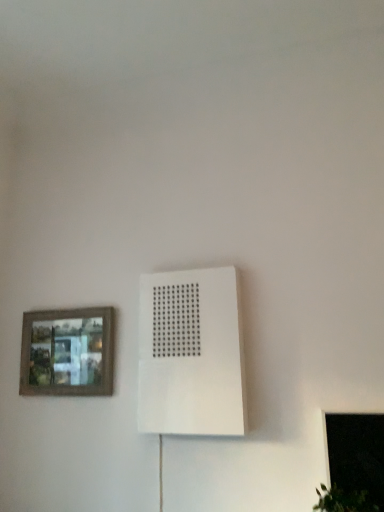
At what (x,y) coordinates should I click in order to perform the action: click on white matte air conditioning at center. Please return your answer as a coordinate pair (x, y). This screenshot has width=384, height=512. Looking at the image, I should click on (191, 354).

At what (x,y) coordinates should I click in order to perform the action: click on transparent glass window at lower right. Please return your answer as a coordinate pair (x, y). This screenshot has width=384, height=512. Looking at the image, I should click on (354, 464).

Where is `wooden framed picture at left`? The width and height of the screenshot is (384, 512). wooden framed picture at left is located at coordinates (67, 352).

In the scene shown: Is wooden framed picture at left far from transparent glass window at lower right?

Yes, wooden framed picture at left and transparent glass window at lower right are located far from each other.

Considering the sizes of wooden framed picture at left and transparent glass window at lower right in the image, is wooden framed picture at left bigger or smaller than transparent glass window at lower right?

Clearly, wooden framed picture at left is larger in size than transparent glass window at lower right.

From a real-world perspective, which is physically above, wooden framed picture at left or transparent glass window at lower right?

wooden framed picture at left is physically above.

Is transparent glass window at lower right thinner than white matte air conditioning at center?

Yes, transparent glass window at lower right is thinner than white matte air conditioning at center.

Which point is more distant from viewer, (356, 507) or (185, 343)?

Point (185, 343)

Which is more to the left, transparent glass window at lower right or white matte air conditioning at center?

From the viewer's perspective, white matte air conditioning at center appears more on the left side.

From the image's perspective, relative to white matte air conditioning at center, is transparent glass window at lower right above or below?

transparent glass window at lower right is situated lower than white matte air conditioning at center in the image.

Which is more to the right, transparent glass window at lower right or wooden framed picture at left?

transparent glass window at lower right.

Choose the correct answer: Is transparent glass window at lower right inside wooden framed picture at left or outside it?

transparent glass window at lower right exists outside the volume of wooden framed picture at left.

Which of these two, transparent glass window at lower right or wooden framed picture at left, stands shorter?

With less height is wooden framed picture at left.

Is transparent glass window at lower right positioned behind wooden framed picture at left?

That is False.

What's the angular difference between white matte air conditioning at center and wooden framed picture at left's facing directions?

The angle between the facing direction of white matte air conditioning at center and the facing direction of wooden framed picture at left is 1.05 degrees.

Which is correct: white matte air conditioning at center is inside wooden framed picture at left, or outside of it?

The correct answer is: outside.

From the picture: Are white matte air conditioning at center and wooden framed picture at left making contact?

There is a gap between white matte air conditioning at center and wooden framed picture at left.

From a real-world perspective, is wooden framed picture at left above or below white matte air conditioning at center?

wooden framed picture at left is situated lower than white matte air conditioning at center in the real world.

Is wooden framed picture at left facing towards white matte air conditioning at center?

No, wooden framed picture at left is not oriented towards white matte air conditioning at center.

Is white matte air conditioning at center wider than transparent glass window at lower right?

Indeed, white matte air conditioning at center has a greater width compared to transparent glass window at lower right.

Between white matte air conditioning at center and transparent glass window at lower right, which one appears on the right side from the viewer's perspective?

transparent glass window at lower right is more to the right.

From a real-world perspective, is white matte air conditioning at center located higher than transparent glass window at lower right?

Yes.

Identify the location of picture frame that is on the left side of transparent glass window at lower right. The image size is (384, 512). (67, 352).

Identify the location of air conditioning behind the transparent glass window at lower right. (191, 354).

Looking at the image, which one is located closer to transparent glass window at lower right, white matte air conditioning at center or wooden framed picture at left?

white matte air conditioning at center is closer to transparent glass window at lower right.

Estimate the real-world distances between objects in this image. Which object is closer to transparent glass window at lower right, wooden framed picture at left or white matte air conditioning at center?

The object closer to transparent glass window at lower right is white matte air conditioning at center.

In the scene shown: Based on their spatial positions, is white matte air conditioning at center or transparent glass window at lower right closer to wooden framed picture at left?

white matte air conditioning at center is positioned closer to the anchor wooden framed picture at left.

From the image, which object appears to be nearer to white matte air conditioning at center, wooden framed picture at left or transparent glass window at lower right?

wooden framed picture at left lies closer to white matte air conditioning at center than the other object.

When comparing their distances from white matte air conditioning at center, does transparent glass window at lower right or wooden framed picture at left seem closer?

wooden framed picture at left is positioned closer to the anchor white matte air conditioning at center.

From the image, which object appears to be nearer to wooden framed picture at left, transparent glass window at lower right or white matte air conditioning at center?

white matte air conditioning at center is closer to wooden framed picture at left.

Locate an element on the screen. The image size is (384, 512). air conditioning located between wooden framed picture at left and transparent glass window at lower right in the left-right direction is located at coordinates (191, 354).